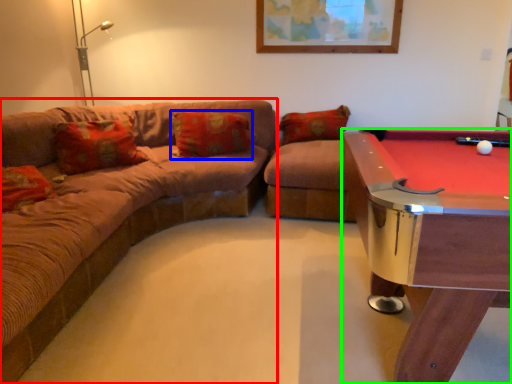
Question: Considering the real-world distances, which object is farthest from studio couch (highlighted by a red box)? pillow (highlighted by a blue box) or billiard table (highlighted by a green box)?

Choices:
 (A) pillow
 (B) billiard table

Answer: (B)